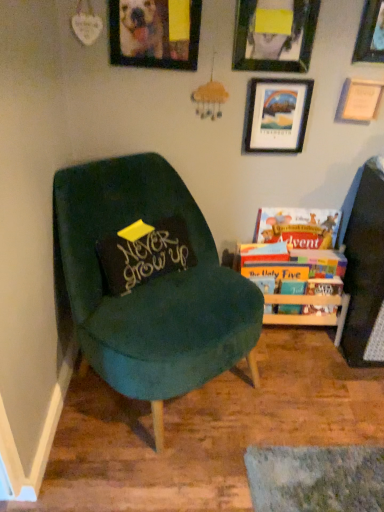
Locate an element on the screen. The height and width of the screenshot is (512, 384). spots to the right of velvet green chair at left is located at coordinates (316, 408).